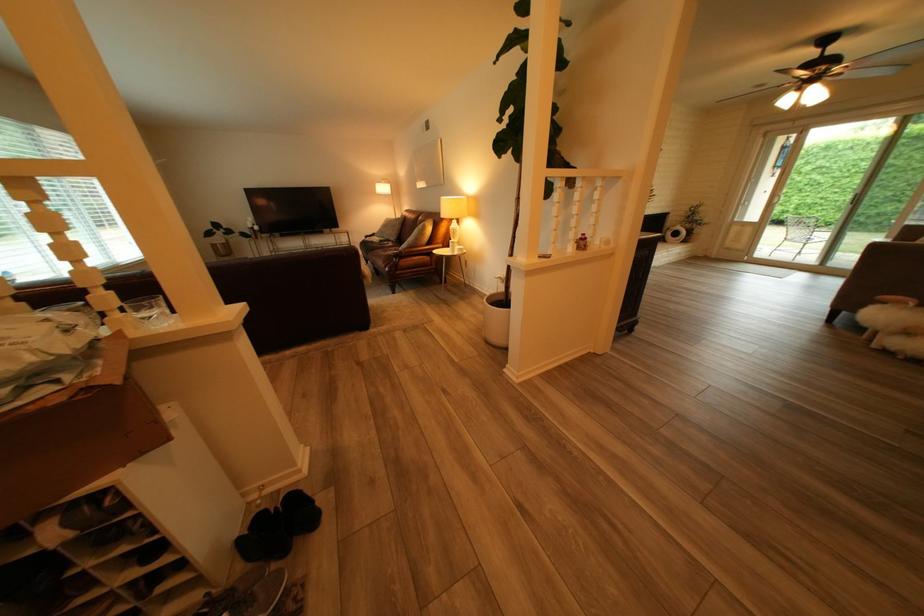
Locate an element on the screen. brown leather sofa sitting surface is located at coordinates (378, 244).